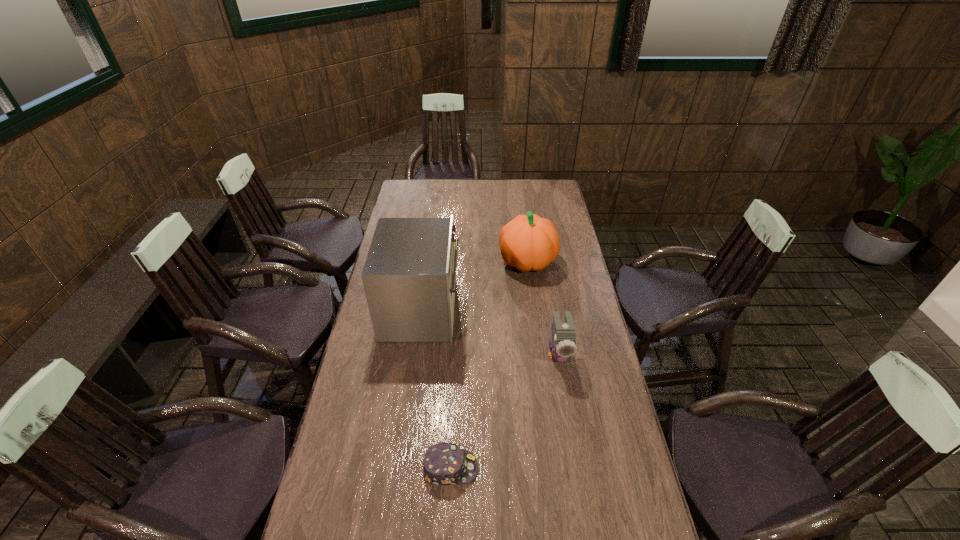
This screenshot has width=960, height=540. I want to click on vacant space that satisfies the following two spatial constraints: 1. at the beak of the third tallest object; 2. on the front-facing side of the nearest object, so (578, 468).

At what (x,y) coordinates should I click in order to perform the action: click on free location that satisfies the following two spatial constraints: 1. at the beak of the third tallest object; 2. on the front-facing side of the headwear. Please return your answer as a coordinate pair (x, y). Looking at the image, I should click on (578, 468).